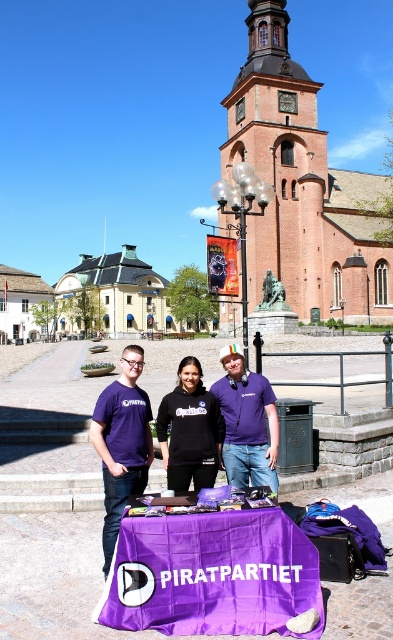
Does point (117, 502) come behind point (257, 392)?

No.

Is black matte hoodie at center smaller than purple cotton t-shirt at center?

No.

Image resolution: width=393 pixels, height=640 pixels. Describe the element at coordinates (121, 444) in the screenshot. I see `black matte hoodie at center` at that location.

Where is `black matte hoodie at center`? The image size is (393, 640). black matte hoodie at center is located at coordinates click(x=121, y=444).

Consider the image. Who is more forward, [310,115] or [277,417]?

Positioned in front is point [277,417].

Is red brick church at center to the left of purple cotton t-shirt at center from the viewer's perspective?

No, red brick church at center is not to the left of purple cotton t-shirt at center.

I want to click on red brick church at center, so click(x=304, y=188).

You are a GUI agent. You are given a task and a screenshot of the screen. Output one action in this format:
    pyautogui.click(x=<x>, y=<y>)
    Task: Click on the red brick church at center
    The image size is (393, 640).
    Given the screenshot: What is the action you would take?
    pyautogui.click(x=304, y=188)

Which is more to the right, red brick church at center or black matte sweatshirt at center?

Positioned to the right is red brick church at center.

Locate an element on the screen. red brick church at center is located at coordinates (x=304, y=188).